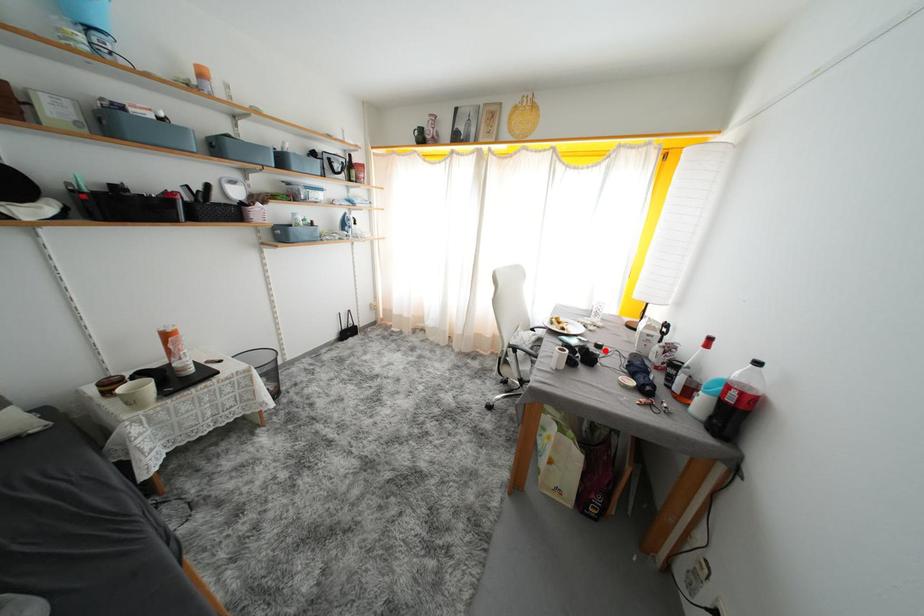
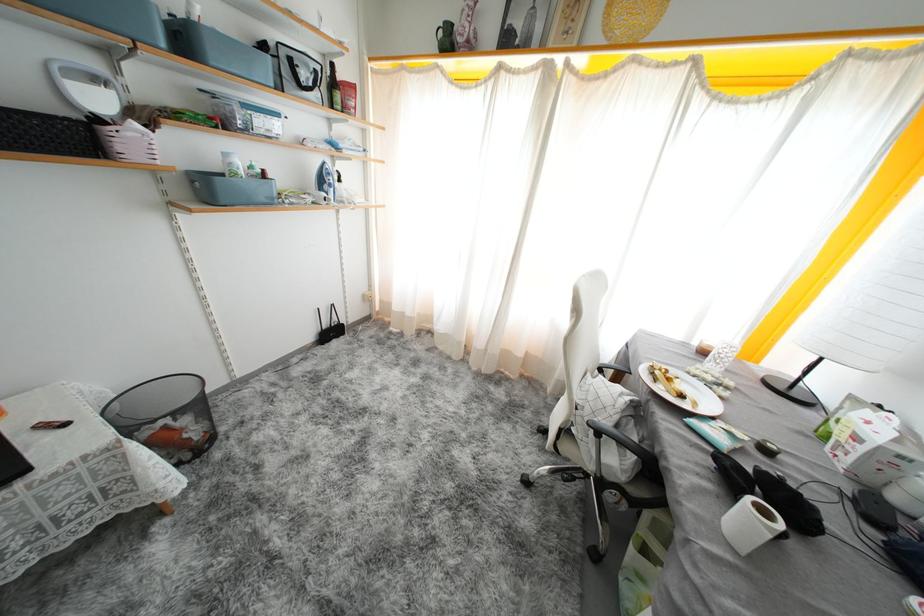
In the second image, find the point that corresponds to the highlighted location in the first image.

(773, 455)